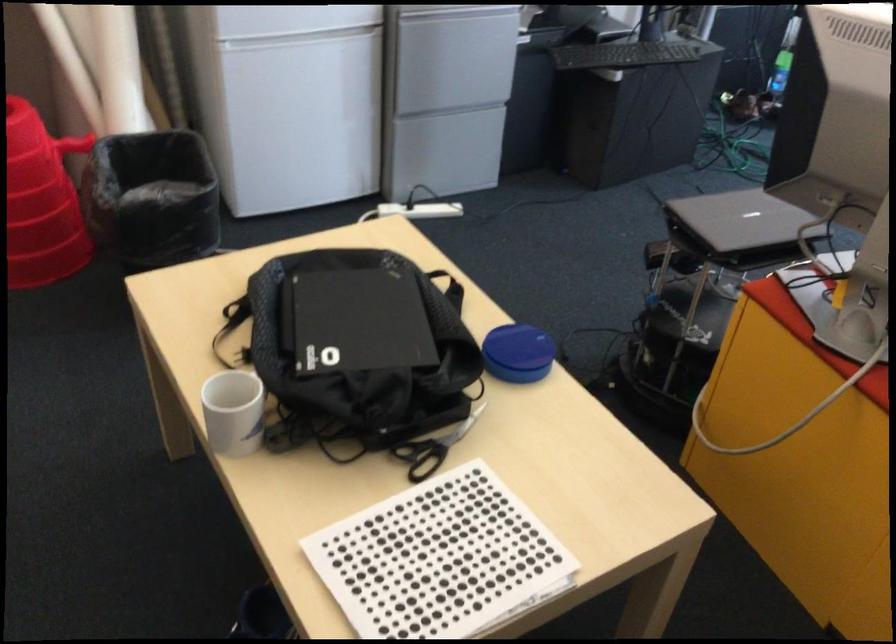
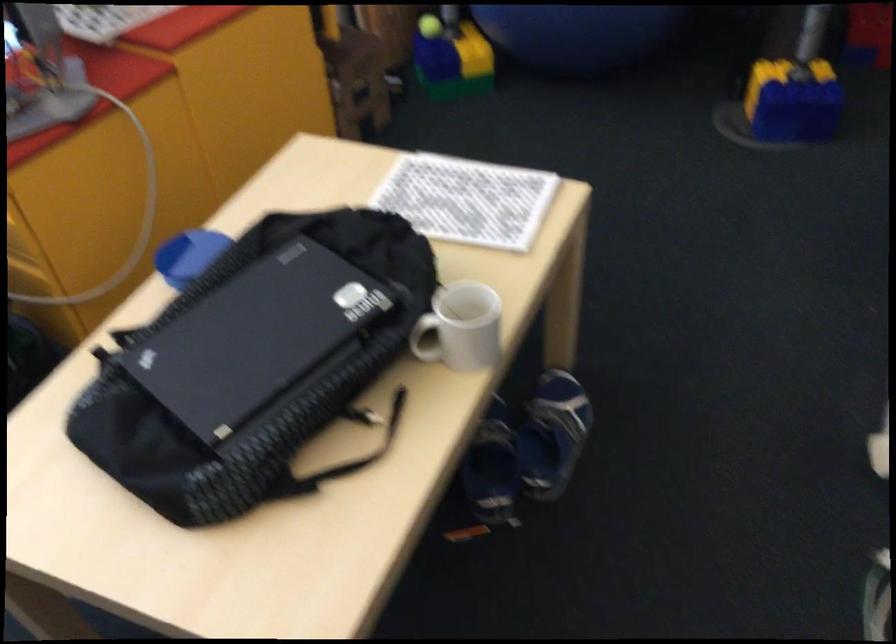
Find the pixel in the second image that matches pixel 524 335 in the first image.

(188, 254)